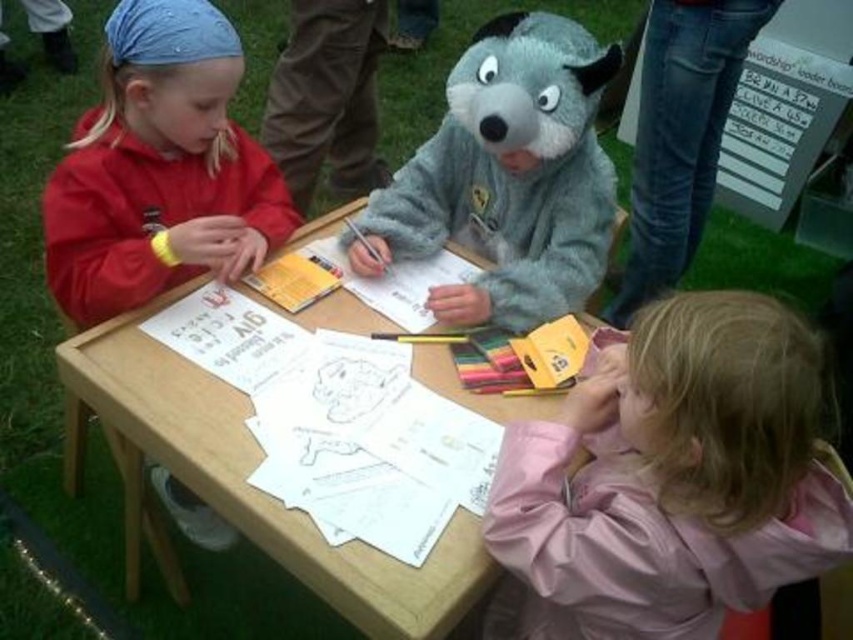
Question: Considering the relative positions of matte red hoodie at left and wooden at center in the image provided, where is matte red hoodie at left located with respect to wooden at center?

Choices:
 (A) left
 (B) right

Answer: (B)

Question: Which of the following is the farthest from the observer?

Choices:
 (A) [604, 426]
 (B) [483, 564]
 (C) [485, 230]
 (D) [210, 68]

Answer: (C)

Question: Does fuzzy gray costume at center appear under wooden at center?

Choices:
 (A) no
 (B) yes

Answer: (A)

Question: Based on their relative distances, which object is farther from the pink fabric jacket at lower right?

Choices:
 (A) wooden at center
 (B) fuzzy gray costume at center
 (C) matte red hoodie at left

Answer: (C)

Question: Which point is closer to the camera taking this photo?

Choices:
 (A) (613, 365)
 (B) (489, 403)

Answer: (A)

Question: Is pink fabric jacket at lower right thinner than wooden at center?

Choices:
 (A) yes
 (B) no

Answer: (A)